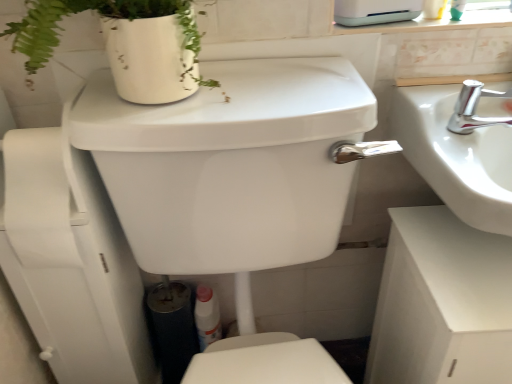
Question: Is there a large distance between white glossy sink at right and white plastic bottle at lower center?

Choices:
 (A) yes
 (B) no

Answer: (B)

Question: Is white glossy sink at right not within white plastic bottle at lower center?

Choices:
 (A) yes
 (B) no

Answer: (A)

Question: Is white glossy sink at right to the right of white plastic bottle at lower center from the viewer's perspective?

Choices:
 (A) no
 (B) yes

Answer: (B)

Question: From the image's perspective, is white glossy sink at right over white plastic bottle at lower center?

Choices:
 (A) yes
 (B) no

Answer: (A)

Question: From a real-world perspective, is white glossy sink at right on top of white plastic bottle at lower center?

Choices:
 (A) no
 (B) yes

Answer: (B)

Question: Is white glossy sink at right further to the viewer compared to white plastic bottle at lower center?

Choices:
 (A) no
 (B) yes

Answer: (A)

Question: Does white matte cabinet at lower right have a lesser width compared to white glossy appliance at upper center?

Choices:
 (A) no
 (B) yes

Answer: (A)

Question: Does white matte cabinet at lower right have a greater width compared to white glossy appliance at upper center?

Choices:
 (A) yes
 (B) no

Answer: (A)

Question: Does white matte cabinet at lower right have a greater height compared to white glossy appliance at upper center?

Choices:
 (A) no
 (B) yes

Answer: (B)

Question: Is white matte cabinet at lower right oriented towards white glossy appliance at upper center?

Choices:
 (A) yes
 (B) no

Answer: (B)

Question: Does white matte cabinet at lower right appear on the left side of white glossy appliance at upper center?

Choices:
 (A) yes
 (B) no

Answer: (B)

Question: From the image's perspective, is white matte cabinet at lower right located above white glossy appliance at upper center?

Choices:
 (A) yes
 (B) no

Answer: (B)

Question: Could you tell me if white glossy appliance at upper center is facing silver metallic faucet at upper right?

Choices:
 (A) no
 (B) yes

Answer: (A)